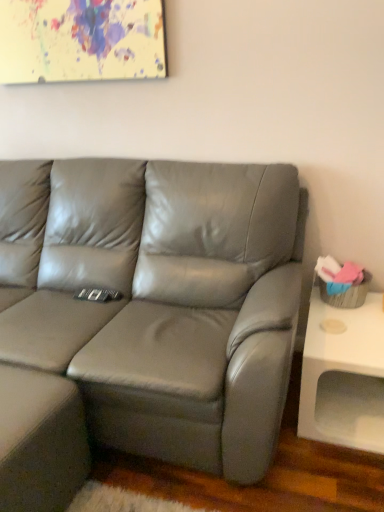
Question: From a real-world perspective, is satin gray leather couch at center over matte gray footrest at lower left?

Choices:
 (A) no
 (B) yes

Answer: (B)

Question: Is satin gray leather couch at center not inside matte gray footrest at lower left?

Choices:
 (A) yes
 (B) no

Answer: (A)

Question: Is satin gray leather couch at center at the left side of matte gray footrest at lower left?

Choices:
 (A) no
 (B) yes

Answer: (A)

Question: Is the depth of satin gray leather couch at center greater than that of matte gray footrest at lower left?

Choices:
 (A) yes
 (B) no

Answer: (B)

Question: Would you say satin gray leather couch at center contains matte gray footrest at lower left?

Choices:
 (A) yes
 (B) no

Answer: (B)

Question: Looking at the image, does satin gray leather couch at center seem bigger or smaller compared to white matte table at right?

Choices:
 (A) big
 (B) small

Answer: (A)

Question: Considering their positions, is satin gray leather couch at center located in front of or behind white matte table at right?

Choices:
 (A) front
 (B) behind

Answer: (A)

Question: From the image's perspective, is satin gray leather couch at center above or below white matte table at right?

Choices:
 (A) above
 (B) below

Answer: (A)

Question: Does point (18, 486) appear closer or farther from the camera than point (326, 385)?

Choices:
 (A) closer
 (B) farther

Answer: (A)

Question: From a real-world perspective, is matte gray footrest at lower left positioned above or below satin gray leather couch at center?

Choices:
 (A) above
 (B) below

Answer: (B)

Question: Considering the positions of matte gray footrest at lower left and satin gray leather couch at center in the image, is matte gray footrest at lower left bigger or smaller than satin gray leather couch at center?

Choices:
 (A) small
 (B) big

Answer: (A)

Question: Considering the relative positions of matte gray footrest at lower left and satin gray leather couch at center in the image provided, is matte gray footrest at lower left to the left or to the right of satin gray leather couch at center?

Choices:
 (A) left
 (B) right

Answer: (A)

Question: From the image's perspective, is matte gray footrest at lower left located above or below satin gray leather couch at center?

Choices:
 (A) below
 (B) above

Answer: (A)

Question: Considering the positions of white matte table at right and satin gray leather couch at center in the image, is white matte table at right wider or thinner than satin gray leather couch at center?

Choices:
 (A) wide
 (B) thin

Answer: (B)

Question: From a real-world perspective, is white matte table at right positioned above or below satin gray leather couch at center?

Choices:
 (A) above
 (B) below

Answer: (B)